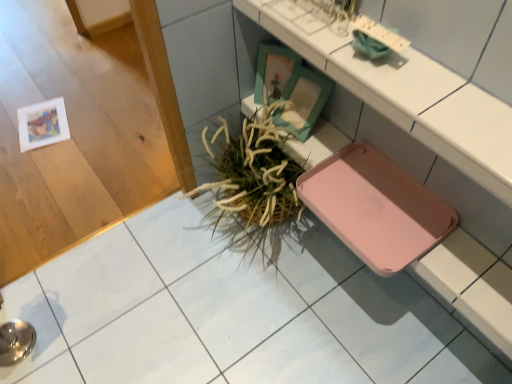
Question: From the image's perspective, is green woven basket at center under matte white counter at center?

Choices:
 (A) no
 (B) yes

Answer: (B)

Question: Is green woven basket at center turned away from matte white counter at center?

Choices:
 (A) no
 (B) yes

Answer: (A)

Question: Considering the relative sizes of green woven basket at center and matte white counter at center in the image provided, is green woven basket at center thinner than matte white counter at center?

Choices:
 (A) no
 (B) yes

Answer: (A)

Question: From a real-world perspective, is green woven basket at center over matte white counter at center?

Choices:
 (A) no
 (B) yes

Answer: (A)

Question: Considering the relative sizes of green woven basket at center and matte white counter at center in the image provided, is green woven basket at center bigger than matte white counter at center?

Choices:
 (A) no
 (B) yes

Answer: (B)

Question: Can you confirm if green woven basket at center is shorter than matte white counter at center?

Choices:
 (A) no
 (B) yes

Answer: (A)

Question: Does matte white counter at center appear on the right side of green woven basket at center?

Choices:
 (A) yes
 (B) no

Answer: (A)

Question: Is matte white counter at center oriented away from green woven basket at center?

Choices:
 (A) yes
 (B) no

Answer: (B)

Question: Is matte white counter at center thinner than green woven basket at center?

Choices:
 (A) yes
 (B) no

Answer: (A)

Question: Considering the relative sizes of matte white counter at center and green woven basket at center in the image provided, is matte white counter at center smaller than green woven basket at center?

Choices:
 (A) no
 (B) yes

Answer: (B)

Question: Can you confirm if matte white counter at center is wider than green woven basket at center?

Choices:
 (A) no
 (B) yes

Answer: (A)

Question: Is matte white counter at center shorter than green woven basket at center?

Choices:
 (A) yes
 (B) no

Answer: (A)

Question: Does metallic silver bowl at lower left lie behind green woven basket at center?

Choices:
 (A) no
 (B) yes

Answer: (A)